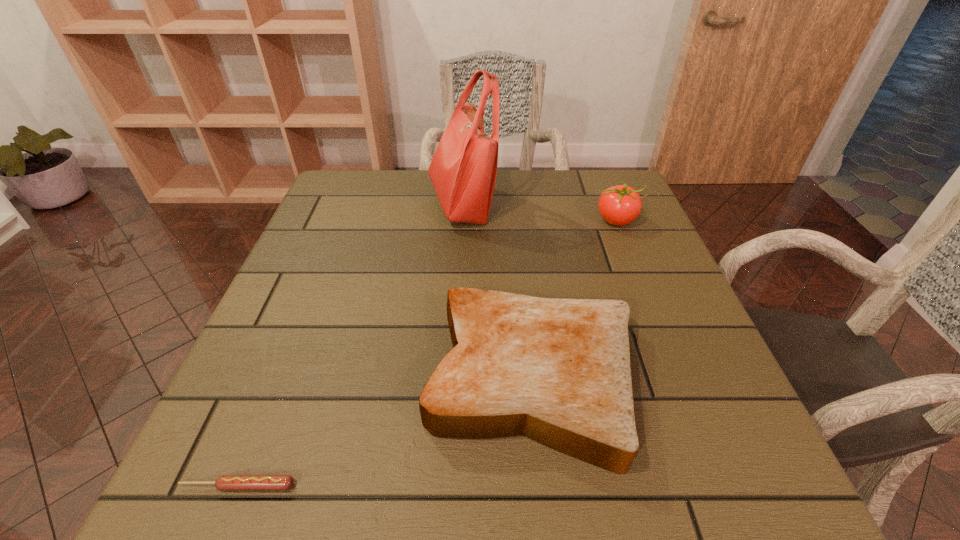
I want to click on object at the near right corner, so click(x=557, y=371).

The width and height of the screenshot is (960, 540). In the image, there is a desktop. Identify the location of vacant area at the far edge. (509, 195).

Image resolution: width=960 pixels, height=540 pixels. In order to click on vacant space at the near edge of the desktop in this screenshot , I will do `click(559, 458)`.

Find the location of a particular element. Image resolution: width=960 pixels, height=540 pixels. free space at the left edge of the desktop is located at coordinates (259, 352).

I want to click on vacant space at the right edge, so click(x=609, y=247).

The width and height of the screenshot is (960, 540). I want to click on free spot at the far left corner of the desktop, so click(378, 203).

Where is `free space at the far right corner of the desktop`? The height and width of the screenshot is (540, 960). free space at the far right corner of the desktop is located at coordinates (575, 180).

This screenshot has height=540, width=960. I want to click on unoccupied position between the third farthest object and the nearest object, so click(x=385, y=433).

Identify the location of vacant space that's between the tallest object and the nearest object. This screenshot has height=540, width=960. (349, 345).

What are the coordinates of `empty location between the shortest object and the handbag` in the screenshot? It's located at (349, 345).